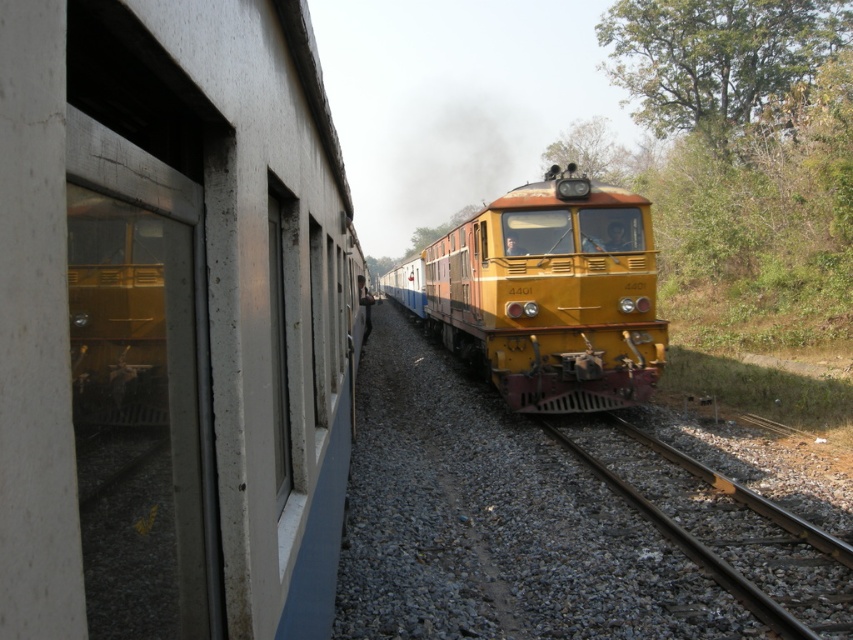
Between green leafy tree at upper right and green leafy tree at upper center, which one is positioned higher?

green leafy tree at upper right

Is green leafy tree at upper right taller than green leafy tree at upper center?

Indeed, green leafy tree at upper right has a greater height compared to green leafy tree at upper center.

Between point (701, 35) and point (625, 150), which one is positioned in front?

Positioned in front is point (701, 35).

Find the location of a particular element. The height and width of the screenshot is (640, 853). green leafy tree at upper right is located at coordinates (718, 60).

Looking at this image, can you confirm if green leafy tree at upper right is taller than smooth metal train track at center?

Yes.

What do you see at coordinates (718, 60) in the screenshot?
I see `green leafy tree at upper right` at bounding box center [718, 60].

Is point (788, 72) behind point (584, 445)?

Yes, it is behind point (584, 445).

Where is `green leafy tree at upper right`? green leafy tree at upper right is located at coordinates (718, 60).

From the picture: Which of these two, smooth metal train track at center or green leafy tree at upper center, stands shorter?

smooth metal train track at center

Can you confirm if smooth metal train track at center is positioned to the right of green leafy tree at upper center?

In fact, smooth metal train track at center is to the left of green leafy tree at upper center.

You are a GUI agent. You are given a task and a screenshot of the screen. Output one action in this format:
    pyautogui.click(x=<x>, y=<y>)
    Task: Click on the smooth metal train track at center
    This screenshot has height=640, width=853.
    Given the screenshot: What is the action you would take?
    pyautogui.click(x=720, y=531)

Identify the location of smooth metal train track at center. The image size is (853, 640). (720, 531).